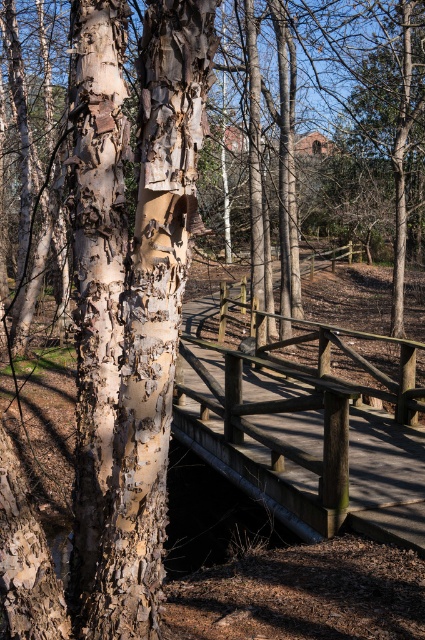
Consider the image. You are standing on the wooden bridge at center and looking towards the white bark tree trunk at center. Which direction should you walk to reach the tree trunk?

The white bark tree trunk at center is to the left of the wooden bridge at center, so you should walk to the left to reach the tree trunk.

You are standing on the wooden bridge and see the point marked at coordinates (x=130, y=300). What does this point represent?

The point at (x=130, y=300) represents the white bark tree trunk at center.